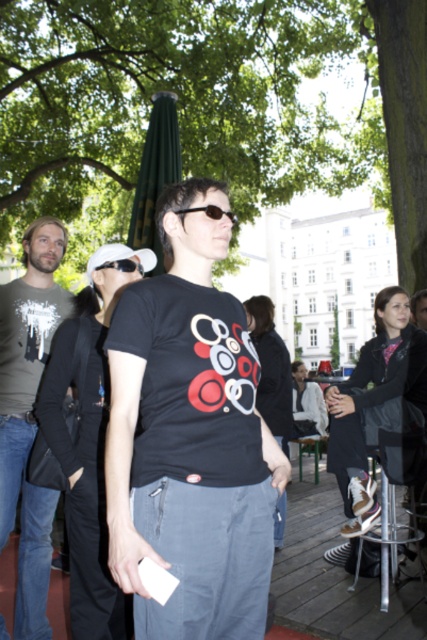
Identify the location of gray cotton t-shirt at left. The image size is (427, 640). (29, 413).

Who is lower down, gray cotton t-shirt at left or black plastic sunglasses at center?

gray cotton t-shirt at left

At what (x,y) coordinates should I click in order to perform the action: click on gray cotton t-shirt at left. Please return your answer as a coordinate pair (x, y). The height and width of the screenshot is (640, 427). Looking at the image, I should click on (29, 413).

Does black plastic sunglasses at center lie in front of black plastic goggles at upper center?

Yes, black plastic sunglasses at center is closer to the viewer.

Between black plastic sunglasses at center and black plastic goggles at upper center, which one has more height?

black plastic sunglasses at center is taller.

Does point (192, 209) lie in front of point (108, 260)?

That is True.

The width and height of the screenshot is (427, 640). I want to click on black plastic sunglasses at center, so click(208, 212).

This screenshot has height=640, width=427. What do you see at coordinates (190, 438) in the screenshot?
I see `black matte t-shirt at center` at bounding box center [190, 438].

Is black matte t-shirt at center to the left of black plastic sunglasses at center from the viewer's perspective?

No, black matte t-shirt at center is not to the left of black plastic sunglasses at center.

Does point (155, 324) lie in front of point (201, 208)?

That is True.

You are a GUI agent. You are given a task and a screenshot of the screen. Output one action in this format:
    pyautogui.click(x=<x>, y=<y>)
    Task: Click on the black matte t-shirt at center
    
    Given the screenshot: What is the action you would take?
    pyautogui.click(x=190, y=438)